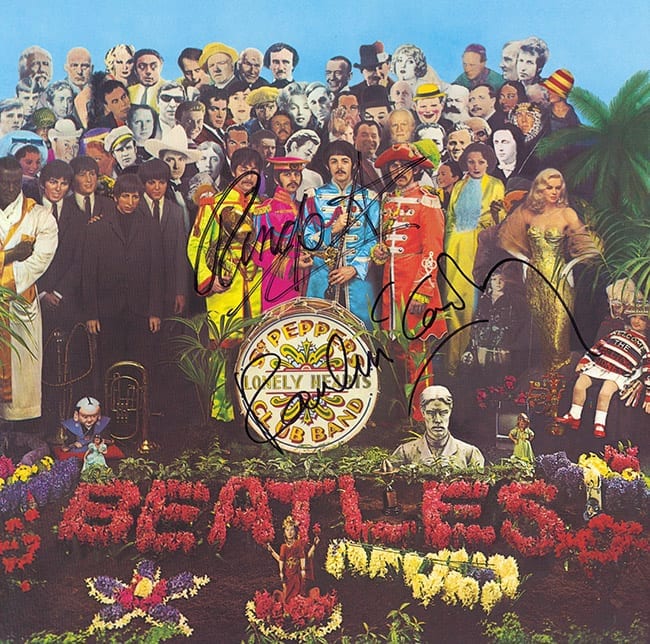
The width and height of the screenshot is (650, 644). I want to click on green plants, so click(x=621, y=149), click(x=624, y=267), click(x=205, y=363), click(x=405, y=368), click(x=315, y=468), click(x=517, y=629), click(x=407, y=629), click(x=155, y=636).